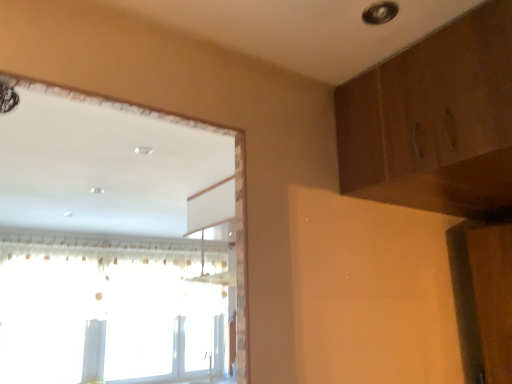
Question: Do you think transparent plastic window at upper left is within white sheer curtain at left, or outside of it?

Choices:
 (A) inside
 (B) outside

Answer: (A)

Question: From a real-world perspective, is transparent plastic window at upper left physically located above or below white sheer curtain at left?

Choices:
 (A) above
 (B) below

Answer: (B)

Question: Estimate the real-world distances between objects in this image. Which object is closer to the white sheer curtain at left?

Choices:
 (A) wooden dresser at upper right
 (B) transparent plastic window at upper left

Answer: (B)

Question: Considering the real-world distances, which object is farthest from the wooden dresser at upper right?

Choices:
 (A) white sheer curtain at left
 (B) transparent plastic window at upper left

Answer: (B)